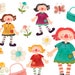
Identify the location of turquoise basket. This screenshot has width=75, height=75. coord(71,16).